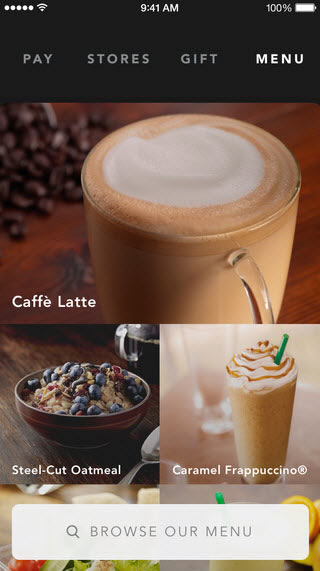
Identify the location of photo of bowl of oatmeal. The height and width of the screenshot is (571, 320). (54, 411).